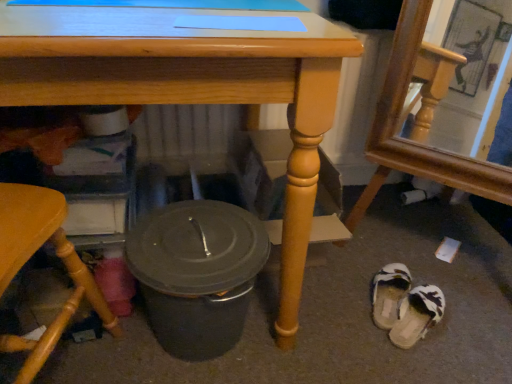
The width and height of the screenshot is (512, 384). What do you see at coordinates (422, 122) in the screenshot?
I see `wooden frame mirror at lower right, positioned as the first chair in right-to-left order` at bounding box center [422, 122].

In order to face matte gray crock pot at lower center, should I rotate leftwards or rightwards?

A 7.662 degree turn to the left will do.

Find the location of a particular element. This screenshot has width=512, height=384. wooden chair at lower left, acting as the 2th chair starting from the right is located at coordinates (31, 256).

This screenshot has height=384, width=512. What are the coordinates of `wooden frame mirror at lower right, positioned as the 2th chair in left-to-right order` in the screenshot? It's located at (422, 122).

Based on the photo, from a real-world perspective, is wooden frame mirror at lower right, positioned as the 2th chair in left-to-right order, below matte wood table at center?

Actually, wooden frame mirror at lower right, positioned as the 2th chair in left-to-right order, is physically above matte wood table at center in the real world.

Does wooden frame mirror at lower right, positioned as the 2th chair in left-to-right order, have a greater height compared to matte wood table at center?

Yes.

Does point (383, 99) lie in front of point (120, 24)?

That is False.

In terms of width, does white fabric slipper at lower right, which is the first footwear in top-to-bottom order, look wider or thinner when compared to wooden frame mirror at lower right, positioned as the 2th chair in left-to-right order?

white fabric slipper at lower right, which is the first footwear in top-to-bottom order, is thinner than wooden frame mirror at lower right, positioned as the 2th chair in left-to-right order.

From a real-world perspective, is white fabric slipper at lower right, which is counted as the second footwear, starting from the bottom, physically located above or below wooden frame mirror at lower right, positioned as the first chair in right-to-left order?

white fabric slipper at lower right, which is counted as the second footwear, starting from the bottom, is below wooden frame mirror at lower right, positioned as the first chair in right-to-left order.

Consider the image. Is white fabric slipper at lower right, which is the first footwear in top-to-bottom order, taller than wooden frame mirror at lower right, positioned as the first chair in right-to-left order?

Incorrect, the height of white fabric slipper at lower right, which is the first footwear in top-to-bottom order, is not larger of that of wooden frame mirror at lower right, positioned as the first chair in right-to-left order.

Which is behind, point (405, 281) or point (413, 336)?

The point (405, 281) is farther from the camera.

Based on the photo, does white fabric slipper at lower right, which is counted as the second footwear, starting from the bottom, have a smaller size compared to white fuzzy slippers at lower right, arranged as the second footwear when viewed from the top?

No.

From their relative heights in the image, would you say white fabric slipper at lower right, which is the first footwear in top-to-bottom order, is taller or shorter than white fuzzy slippers at lower right, arranged as the second footwear when viewed from the top?

white fabric slipper at lower right, which is the first footwear in top-to-bottom order, is taller than white fuzzy slippers at lower right, arranged as the second footwear when viewed from the top.

Is matte wood table at center outside of white fuzzy slippers at lower right, arranged as the second footwear when viewed from the top?

Absolutely, matte wood table at center is external to white fuzzy slippers at lower right, arranged as the second footwear when viewed from the top.

Can you confirm if matte wood table at center is positioned to the right of white fuzzy slippers at lower right, marked as the 1th footwear in a bottom-to-top arrangement?

No.

Are matte wood table at center and white fuzzy slippers at lower right, marked as the 1th footwear in a bottom-to-top arrangement, beside each other?

No, matte wood table at center is not in contact with white fuzzy slippers at lower right, marked as the 1th footwear in a bottom-to-top arrangement.

Who is shorter, matte gray crock pot at lower center or white fuzzy slippers at lower right, marked as the 1th footwear in a bottom-to-top arrangement?

With less height is white fuzzy slippers at lower right, marked as the 1th footwear in a bottom-to-top arrangement.

Are matte gray crock pot at lower center and white fuzzy slippers at lower right, marked as the 1th footwear in a bottom-to-top arrangement, far apart?

Actually, matte gray crock pot at lower center and white fuzzy slippers at lower right, marked as the 1th footwear in a bottom-to-top arrangement, are a little close together.

Would you say matte gray crock pot at lower center contains white fuzzy slippers at lower right, arranged as the second footwear when viewed from the top?

Definitely not — white fuzzy slippers at lower right, arranged as the second footwear when viewed from the top, is not inside matte gray crock pot at lower center.

Locate an element on the screen. This screenshot has width=512, height=384. crock pot in front of the white fuzzy slippers at lower right, marked as the 1th footwear in a bottom-to-top arrangement is located at coordinates (197, 274).

Does white fuzzy slippers at lower right, arranged as the second footwear when viewed from the top, turn towards matte gray crock pot at lower center?

No, white fuzzy slippers at lower right, arranged as the second footwear when viewed from the top, is not aimed at matte gray crock pot at lower center.

From their relative heights in the image, would you say white fuzzy slippers at lower right, arranged as the second footwear when viewed from the top, is taller or shorter than matte gray crock pot at lower center?

white fuzzy slippers at lower right, arranged as the second footwear when viewed from the top, is shorter than matte gray crock pot at lower center.

Does point (398, 343) lie behind point (216, 242)?

Yes, point (398, 343) is behind point (216, 242).

Would you say white fuzzy slippers at lower right, arranged as the second footwear when viewed from the top, contains matte gray crock pot at lower center?

No, matte gray crock pot at lower center is not surrounded by white fuzzy slippers at lower right, arranged as the second footwear when viewed from the top.

Considering the sizes of objects matte gray crock pot at lower center and wooden chair at lower left, the 1th chair when ordered from left to right, in the image provided, who is shorter, matte gray crock pot at lower center or wooden chair at lower left, the 1th chair when ordered from left to right,?

Standing shorter between the two is matte gray crock pot at lower center.

Is matte gray crock pot at lower center looking in the opposite direction of wooden chair at lower left, the 1th chair when ordered from left to right?

matte gray crock pot at lower center does not have its back to wooden chair at lower left, the 1th chair when ordered from left to right.

Who is more distant, matte gray crock pot at lower center or wooden chair at lower left, acting as the 2th chair starting from the right?

matte gray crock pot at lower center is further from the camera.

Is matte gray crock pot at lower center to the left or to the right of wooden chair at lower left, the 1th chair when ordered from left to right, in the image?

Based on their positions, matte gray crock pot at lower center is located to the right of wooden chair at lower left, the 1th chair when ordered from left to right.

Find the location of a particular element. chair that appears above the matte wood table at center (from the image's perspective) is located at coordinates (422, 122).

Starting from the white fabric slipper at lower right, which is counted as the second footwear, starting from the bottom, which chair is the 1st one in front? Please provide its 2D coordinates.

[(422, 122)]

Estimate the real-world distances between objects in this image. Which object is further from matte gray crock pot at lower center, white fuzzy slippers at lower right, arranged as the second footwear when viewed from the top, or wooden chair at lower left, acting as the 2th chair starting from the right?

The object further to matte gray crock pot at lower center is white fuzzy slippers at lower right, arranged as the second footwear when viewed from the top.

Looking at this image, estimate the real-world distances between objects in this image. Which object is closer to wooden frame mirror at lower right, positioned as the first chair in right-to-left order, wooden chair at lower left, the 1th chair when ordered from left to right, or white fabric slipper at lower right, which is counted as the second footwear, starting from the bottom?

white fabric slipper at lower right, which is counted as the second footwear, starting from the bottom, lies closer to wooden frame mirror at lower right, positioned as the first chair in right-to-left order, than the other object.

Estimate the real-world distances between objects in this image. Which object is closer to wooden frame mirror at lower right, positioned as the first chair in right-to-left order, white fabric slipper at lower right, which is counted as the second footwear, starting from the bottom, or matte gray crock pot at lower center?

Among the two, white fabric slipper at lower right, which is counted as the second footwear, starting from the bottom, is located nearer to wooden frame mirror at lower right, positioned as the first chair in right-to-left order.

From the image, which object appears to be nearer to white fuzzy slippers at lower right, arranged as the second footwear when viewed from the top, wooden chair at lower left, the 1th chair when ordered from left to right, or wooden frame mirror at lower right, positioned as the first chair in right-to-left order?

The object closer to white fuzzy slippers at lower right, arranged as the second footwear when viewed from the top, is wooden frame mirror at lower right, positioned as the first chair in right-to-left order.

Looking at the image, which one is located further to white fabric slipper at lower right, which is counted as the second footwear, starting from the bottom, wooden frame mirror at lower right, positioned as the 2th chair in left-to-right order, or wooden chair at lower left, acting as the 2th chair starting from the right?

The object further to white fabric slipper at lower right, which is counted as the second footwear, starting from the bottom, is wooden chair at lower left, acting as the 2th chair starting from the right.

From the image, which object appears to be farther from wooden frame mirror at lower right, positioned as the first chair in right-to-left order, matte gray crock pot at lower center or white fuzzy slippers at lower right, arranged as the second footwear when viewed from the top?

matte gray crock pot at lower center is positioned further to the anchor wooden frame mirror at lower right, positioned as the first chair in right-to-left order.

From the image, which object appears to be nearer to white fuzzy slippers at lower right, marked as the 1th footwear in a bottom-to-top arrangement, wooden frame mirror at lower right, positioned as the 2th chair in left-to-right order, or matte gray crock pot at lower center?

Based on the image, wooden frame mirror at lower right, positioned as the 2th chair in left-to-right order, appears to be nearer to white fuzzy slippers at lower right, marked as the 1th footwear in a bottom-to-top arrangement.

Which object lies nearer to the anchor point wooden chair at lower left, acting as the 2th chair starting from the right, white fabric slipper at lower right, which is counted as the second footwear, starting from the bottom, or matte gray crock pot at lower center?

matte gray crock pot at lower center is positioned closer to the anchor wooden chair at lower left, acting as the 2th chair starting from the right.

Find the location of a particular element. crock pot between matte wood table at center and white fabric slipper at lower right, which is the first footwear in top-to-bottom order is located at coordinates (197, 274).

The image size is (512, 384). I want to click on crock pot between matte wood table at center and wooden frame mirror at lower right, positioned as the first chair in right-to-left order, from left to right, so click(x=197, y=274).

Where is `crock pot between wooden chair at lower left, acting as the 2th chair starting from the right, and white fuzzy slippers at lower right, arranged as the second footwear when viewed from the top, from left to right`? This screenshot has width=512, height=384. crock pot between wooden chair at lower left, acting as the 2th chair starting from the right, and white fuzzy slippers at lower right, arranged as the second footwear when viewed from the top, from left to right is located at coordinates (197, 274).

Find the location of a particular element. footwear between wooden frame mirror at lower right, positioned as the 2th chair in left-to-right order, and white fuzzy slippers at lower right, arranged as the second footwear when viewed from the top, vertically is located at coordinates (389, 293).